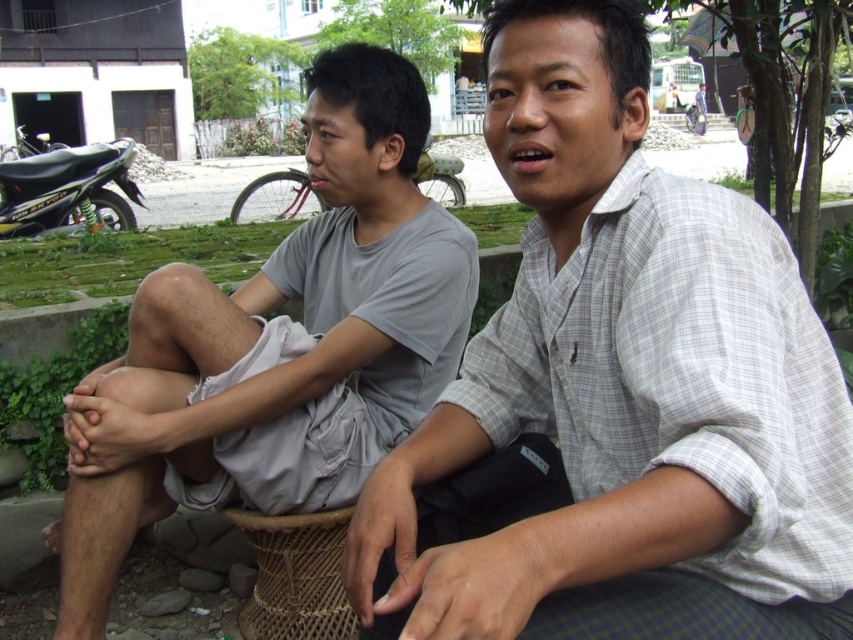
Question: Which of the following is the farthest from the observer?

Choices:
 (A) (260, 211)
 (B) (627, 324)
 (C) (109, 193)

Answer: (A)

Question: Which object is farther from the camera taking this photo?

Choices:
 (A) white checkered shirt at center
 (B) woven brown basket at lower center
 (C) metallic silver motorcycle at center

Answer: (C)

Question: Does shiny black motorcycle at left have a smaller size compared to metallic silver motorcycle at center?

Choices:
 (A) yes
 (B) no

Answer: (A)

Question: Estimate the real-world distances between objects in this image. Which object is farther from the metallic silver motorcycle at center?

Choices:
 (A) woven brown basket at lower center
 (B) shiny black motorcycle at left
 (C) gray cotton t-shirt at left

Answer: (C)

Question: Can you confirm if woven brown basket at lower center is positioned below shiny black motorcycle at left?

Choices:
 (A) yes
 (B) no

Answer: (A)

Question: Can you confirm if shiny black motorcycle at left is positioned to the left of metallic silver motorcycle at center?

Choices:
 (A) no
 (B) yes

Answer: (B)